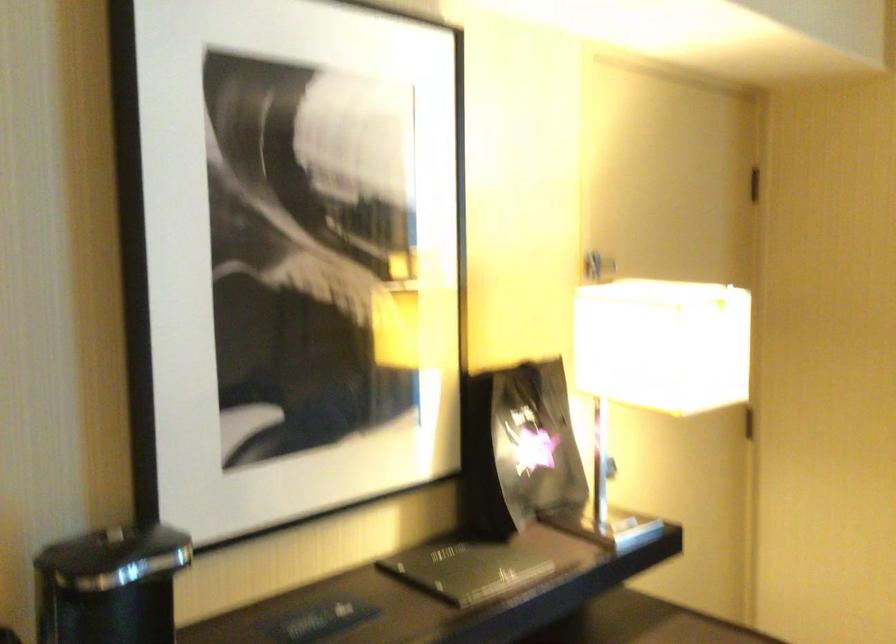
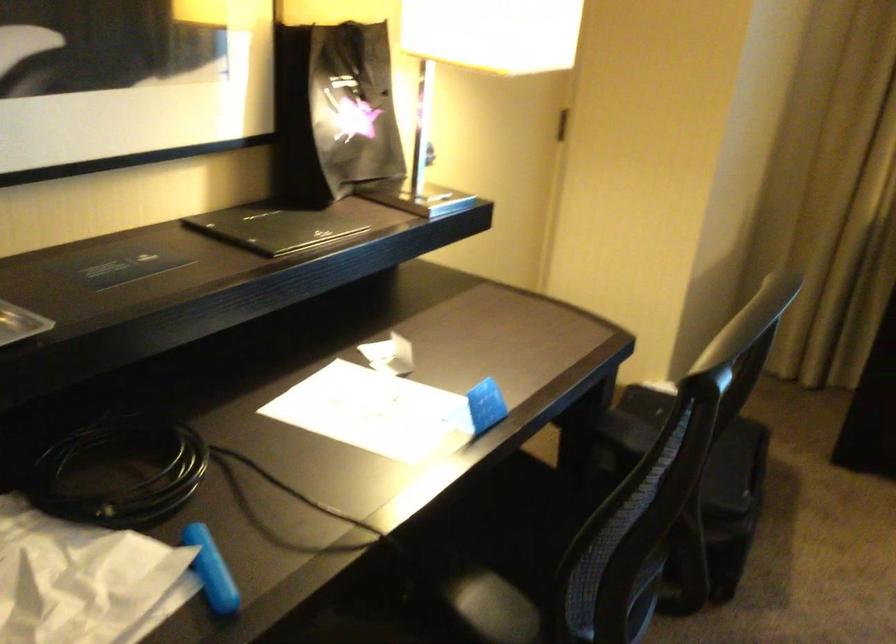
Locate, in the second image, the point that corresponds to pixel 515 444 in the first image.

(334, 111)